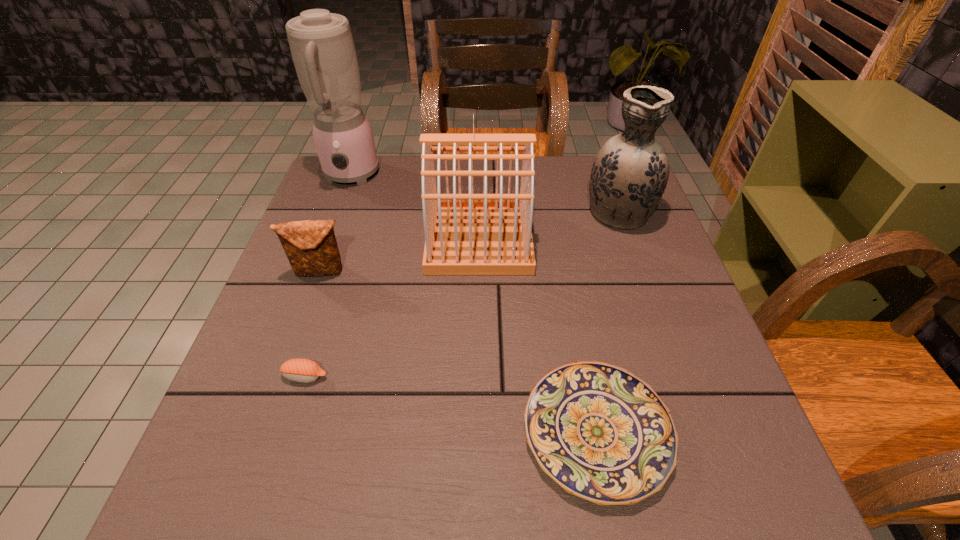
The image size is (960, 540). In order to click on blank space located on the back of the second shortest object in this screenshot , I will do point(327,307).

Identify the location of free space located 0.240m on the back of the plate. This screenshot has width=960, height=540. (567, 277).

Where is `food processor that is at the far edge`? The height and width of the screenshot is (540, 960). food processor that is at the far edge is located at coordinates (322, 48).

Locate an element on the screen. vase that is at the far edge is located at coordinates (629, 175).

Locate an element on the screen. The width and height of the screenshot is (960, 540). object located at the near edge is located at coordinates (601, 433).

Locate an element on the screen. This screenshot has height=540, width=960. food processor at the left edge is located at coordinates (322, 48).

Where is `clutch bag that is at the left edge`? The width and height of the screenshot is (960, 540). clutch bag that is at the left edge is located at coordinates (311, 247).

This screenshot has height=540, width=960. I want to click on sushi that is at the left edge, so click(301, 370).

Locate an element on the screen. vase that is at the right edge is located at coordinates (629, 175).

Identify the location of plate present at the right edge. (601, 433).